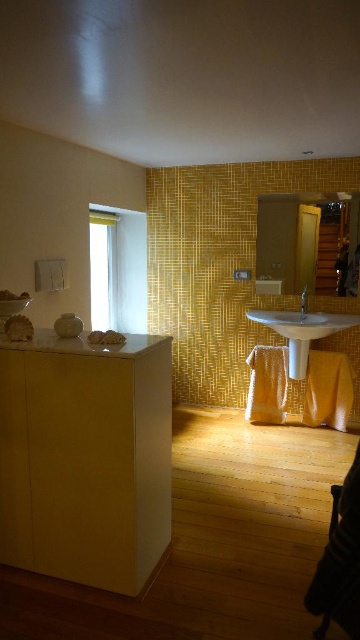
Question: Which object is farther from the camera taking this photo?

Choices:
 (A) white sheer curtain at upper left
 (B) wooden chair at lower right

Answer: (A)

Question: Can you confirm if matte yellow cabinet at left is smaller than satin nickel faucet at center?

Choices:
 (A) yes
 (B) no

Answer: (B)

Question: Can you confirm if white sheer curtain at upper left is positioned to the left of white marble counter top at center?

Choices:
 (A) yes
 (B) no

Answer: (A)

Question: Based on their relative distances, which object is nearer to the matte yellow cabinet at left?

Choices:
 (A) white sheer curtain at upper left
 (B) wooden chair at lower right

Answer: (B)

Question: Can you confirm if white sheer curtain at upper left is positioned below white marble counter top at center?

Choices:
 (A) no
 (B) yes

Answer: (A)

Question: Which object is closer to the camera taking this photo?

Choices:
 (A) white marble counter top at center
 (B) white sheer curtain at upper left
 (C) matte yellow cabinet at left

Answer: (A)